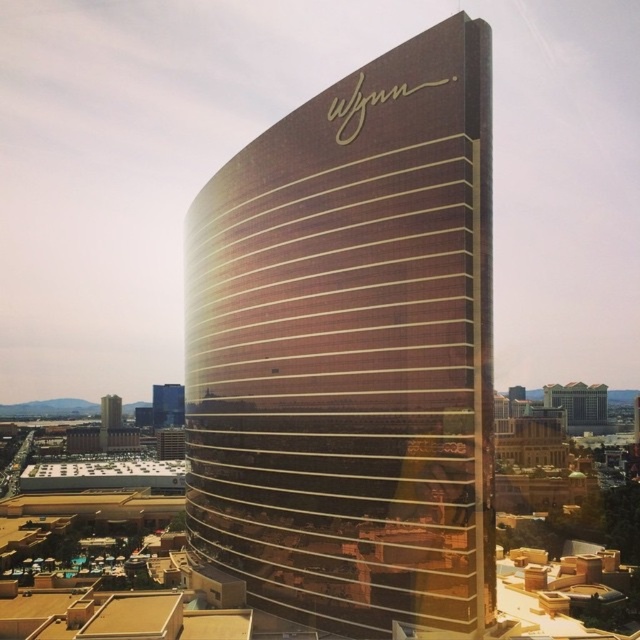
Question: Can you confirm if shiny glass skyscraper at center is positioned to the right of gold reflective glass tower at lower left?

Choices:
 (A) no
 (B) yes

Answer: (B)

Question: Which point is farther from the camera taking this photo?

Choices:
 (A) (572, 388)
 (B) (228, 449)

Answer: (A)

Question: Is gold reflective glass building at center below gold reflective hotel at center?

Choices:
 (A) no
 (B) yes

Answer: (A)

Question: Which object appears closest to the camera in this image?

Choices:
 (A) gold reflective glass tower at lower left
 (B) shiny glass skyscraper at center

Answer: (B)

Question: Which object appears closest to the camera in this image?

Choices:
 (A) shiny glass skyscraper at center
 (B) gold reflective glass building at center
 (C) gold reflective hotel at center
 (D) gold reflective glass tower at lower left

Answer: (B)

Question: Does gold reflective hotel at center appear on the right side of gold reflective glass tower at lower left?

Choices:
 (A) yes
 (B) no

Answer: (A)